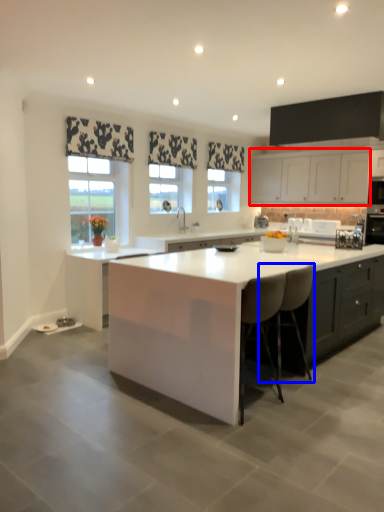
Question: Which object appears closest to the camera in this image, cabinetry (highlighted by a red box) or chair (highlighted by a blue box)?

Choices:
 (A) cabinetry
 (B) chair

Answer: (B)